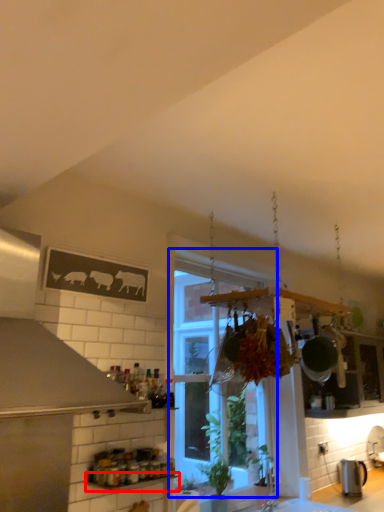
Question: Among these objects, which one is nearest to the camera, window sill (highlighted by a red box) or window (highlighted by a blue box)?

Choices:
 (A) window sill
 (B) window

Answer: (A)